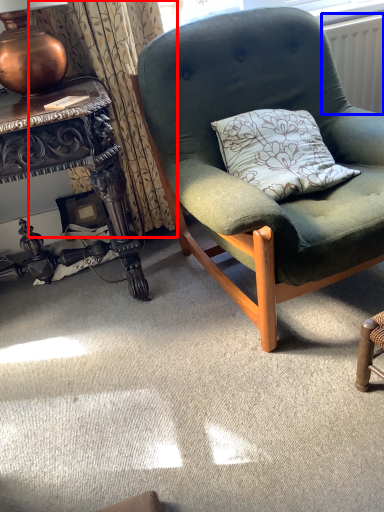
Question: Which of the following is the farthest to the observer, curtain (highlighted by a red box) or radiator (highlighted by a blue box)?

Choices:
 (A) curtain
 (B) radiator

Answer: (B)